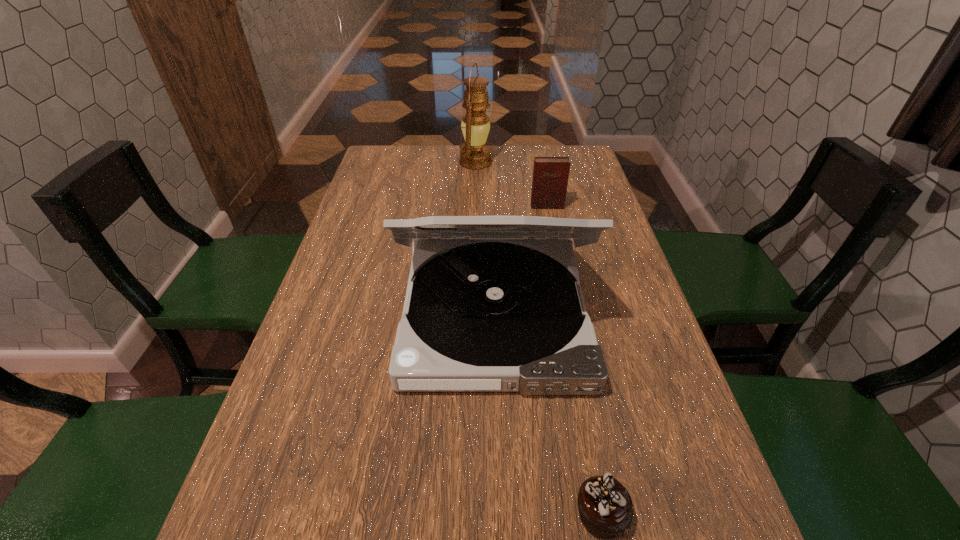
Image resolution: width=960 pixels, height=540 pixels. Identify the location of free space at the far edge. (459, 167).

Identify the location of vacant region at the left edge of the desktop. (391, 214).

Locate an element on the screen. The height and width of the screenshot is (540, 960). free space at the right edge is located at coordinates (602, 272).

Image resolution: width=960 pixels, height=540 pixels. What are the coordinates of `free point at the far right corner` in the screenshot? It's located at (584, 148).

Locate which object ranks in proximity to the farthest object. Please provide its 2D coordinates. Your answer should be formatted as a tuple, i.e. [(x, y)], where the tuple contains the x and y coordinates of a point satisfying the conditions above.

[(550, 174)]

This screenshot has height=540, width=960. I want to click on object that can be found as the third closest to the oil lamp, so [x=605, y=506].